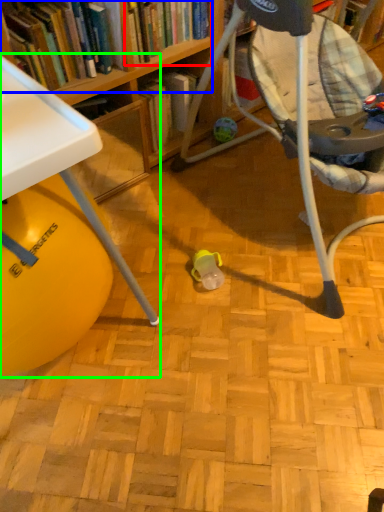
Question: Which object is positioned farthest from book (highlighted by a red box)? Select from book (highlighted by a blue box) and table (highlighted by a green box).

Choices:
 (A) book
 (B) table

Answer: (B)